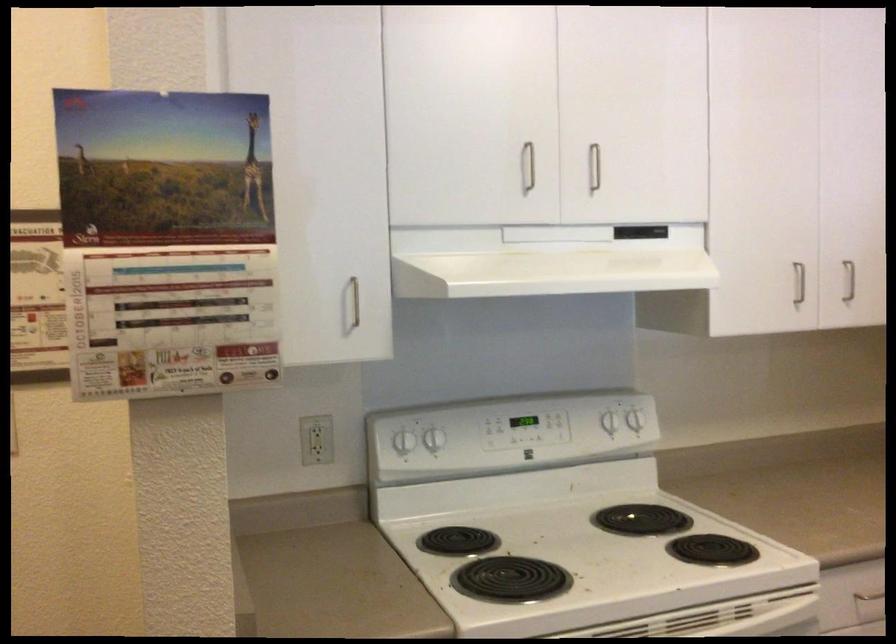
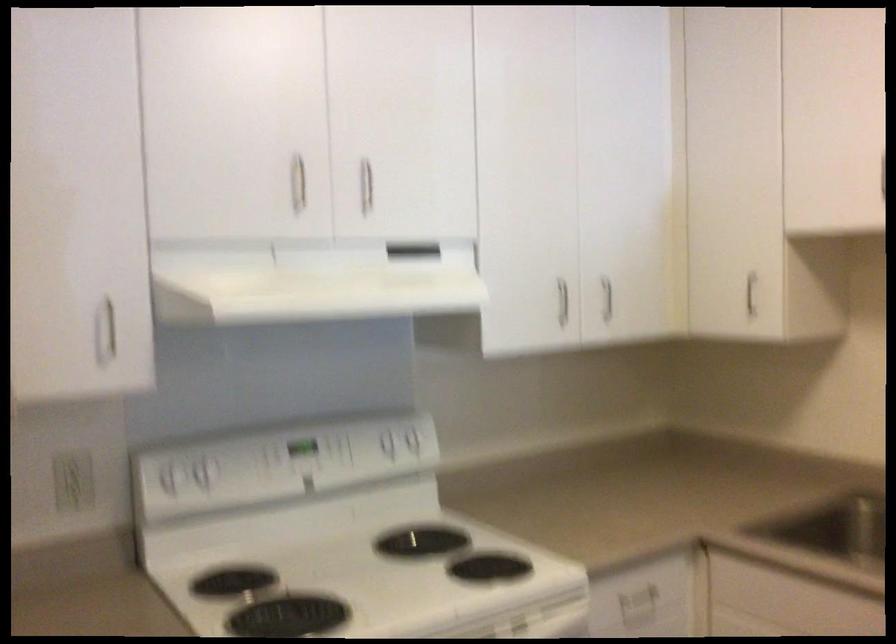
The point at (799, 281) is marked in the first image. Where is the corresponding point in the second image?

(562, 301)